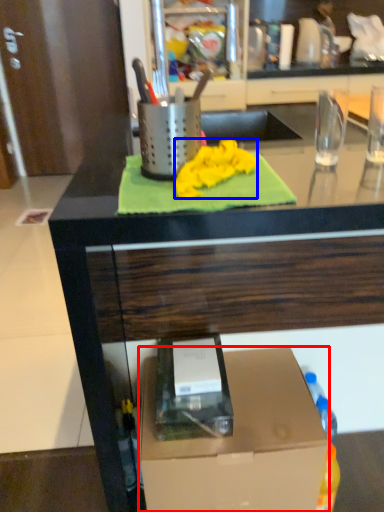
Question: Which of the following is the farthest to the observer, box (highlighted by a red box) or cloth (highlighted by a blue box)?

Choices:
 (A) box
 (B) cloth

Answer: (A)